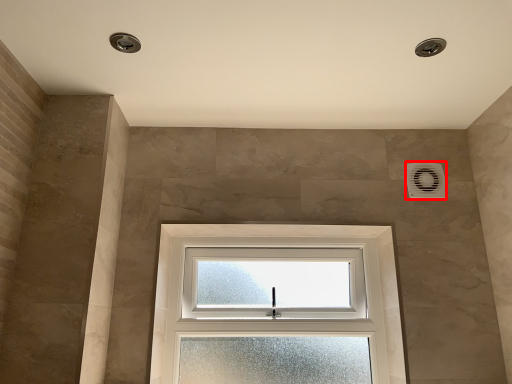
Question: From the image, what is the correct spatial relationship of air conditioning (annotated by the red box) in relation to window?

Choices:
 (A) left
 (B) right

Answer: (B)